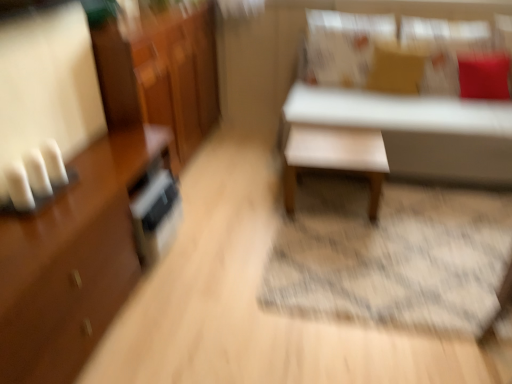
Question: Can you confirm if matte brown pillow at upper center, the second pillow from the right, is shorter than smooth beige table at center, the second table positioned from the right?

Choices:
 (A) no
 (B) yes

Answer: (A)

Question: Can you confirm if matte brown pillow at upper center, the second pillow viewed from the left, is thinner than smooth beige table at center, the second table positioned from the right?

Choices:
 (A) no
 (B) yes

Answer: (B)

Question: Can you confirm if matte brown pillow at upper center, the second pillow from the right, is bigger than smooth beige table at center, the second table positioned from the right?

Choices:
 (A) no
 (B) yes

Answer: (A)

Question: Considering the relative sizes of matte brown pillow at upper center, the second pillow from the right, and smooth beige table at center, the second table positioned from the right, in the image provided, is matte brown pillow at upper center, the second pillow from the right, smaller than smooth beige table at center, the second table positioned from the right,?

Choices:
 (A) yes
 (B) no

Answer: (A)

Question: Is matte brown pillow at upper center, the second pillow from the right, closer to camera compared to smooth beige table at center, which is the 1th table in left-to-right order?

Choices:
 (A) yes
 (B) no

Answer: (B)

Question: Considering the relative sizes of matte brown pillow at upper center, the second pillow from the right, and smooth beige table at center, the second table positioned from the right, in the image provided, is matte brown pillow at upper center, the second pillow from the right, wider than smooth beige table at center, the second table positioned from the right,?

Choices:
 (A) yes
 (B) no

Answer: (B)

Question: Can you confirm if brown glossy cabinet at left is bigger than red velvet cushion at upper right, the first pillow when ordered from right to left?

Choices:
 (A) yes
 (B) no

Answer: (A)

Question: Can you confirm if brown glossy cabinet at left is shorter than red velvet cushion at upper right, the first pillow when ordered from right to left?

Choices:
 (A) no
 (B) yes

Answer: (A)

Question: Is brown glossy cabinet at left positioned beyond the bounds of red velvet cushion at upper right, which is counted as the third pillow, starting from the left?

Choices:
 (A) yes
 (B) no

Answer: (A)

Question: From a real-world perspective, is brown glossy cabinet at left under red velvet cushion at upper right, which is counted as the third pillow, starting from the left?

Choices:
 (A) yes
 (B) no

Answer: (A)

Question: Is brown glossy cabinet at left looking in the opposite direction of red velvet cushion at upper right, the first pillow when ordered from right to left?

Choices:
 (A) no
 (B) yes

Answer: (A)

Question: Does brown glossy cabinet at left have a lesser width compared to red velvet cushion at upper right, the first pillow when ordered from right to left?

Choices:
 (A) yes
 (B) no

Answer: (B)

Question: Is there a large distance between shiny brown dresser at left and brown glossy cabinet at left?

Choices:
 (A) no
 (B) yes

Answer: (A)